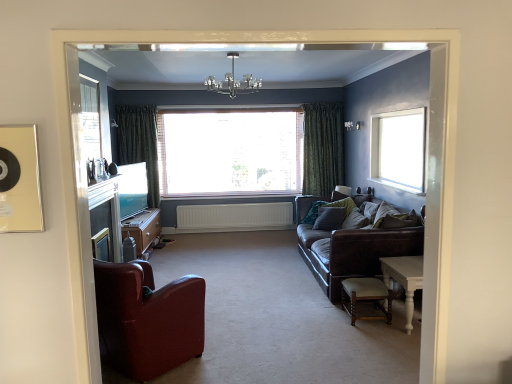
Question: Is light beige leather stool at lower right spatially inside clear glass window at upper right, which ranks as the second window in back-to-front order, or outside of it?

Choices:
 (A) outside
 (B) inside

Answer: (A)

Question: Is light beige leather stool at lower right taller or shorter than clear glass window at upper right, which ranks as the second window in back-to-front order?

Choices:
 (A) tall
 (B) short

Answer: (B)

Question: Which is farther from the white matte radiator at center?

Choices:
 (A) green textured curtain at left, which is counted as the second curtain, starting from the right
 (B) leather armchair at left
 (C) transparent glass window at center, which is the second window from front to back
 (D) green textured curtain at center, the 1th curtain viewed from the right
 (E) light beige leather stool at lower right

Answer: (B)

Question: Which object is the farthest from the green textured curtain at center, the 1th curtain viewed from the right?

Choices:
 (A) teal fabric pillow at right, positioned as the 3th pillow in front-to-back order
 (B) transparent glass window at center, which is the second window from front to back
 (C) leather armchair at left
 (D) matte black entertainment center at left
 (E) green textured curtain at left, which is counted as the second curtain, starting from the right

Answer: (C)